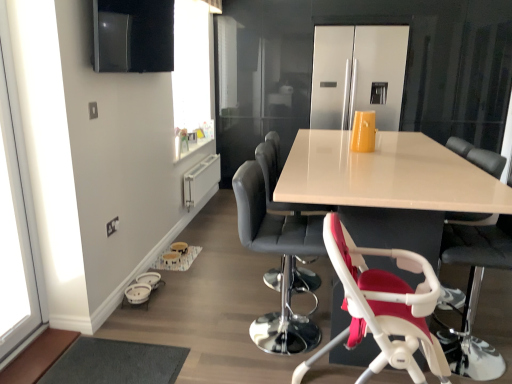
The height and width of the screenshot is (384, 512). I want to click on black leather bar stool at center, marked as the 2th chair in a back-to-front arrangement, so point(281,264).

Where is `white plastic highchair at lower right, which ranks as the second chair in front-to-back order`? The image size is (512, 384). white plastic highchair at lower right, which ranks as the second chair in front-to-back order is located at coordinates (474, 291).

The width and height of the screenshot is (512, 384). Describe the element at coordinates (474, 291) in the screenshot. I see `white plastic highchair at lower right, the 3th chair from the back` at that location.

What is the approximate width of leather-like black chair at center, which is counted as the 4th chair, starting from the front?

The width of leather-like black chair at center, which is counted as the 4th chair, starting from the front, is 15.42 inches.

What do you see at coordinates (278, 177) in the screenshot?
I see `leather-like black chair at center, which is the 1th chair from back to front` at bounding box center [278, 177].

The width and height of the screenshot is (512, 384). Find the location of `white plastic highchair at lower right, which is the 1th chair in front-to-back order`. white plastic highchair at lower right, which is the 1th chair in front-to-back order is located at coordinates (383, 307).

What do you see at coordinates (142, 289) in the screenshot? The image size is (512, 384). I see `white plastic baby carriage at lower left` at bounding box center [142, 289].

This screenshot has height=384, width=512. In order to click on black leather bar stool at center, marked as the 2th chair in a back-to-front arrangement in this screenshot , I will do `click(281, 264)`.

Is leather-like black chair at center, which is the 1th chair from back to front, far away from stainless steel refrigerator at center?

Yes.

Is leather-like black chair at center, which is the 1th chair from back to front, facing towards stainless steel refrigerator at center?

No, leather-like black chair at center, which is the 1th chair from back to front, is not aimed at stainless steel refrigerator at center.

From a real-world perspective, is leather-like black chair at center, which is counted as the 4th chair, starting from the front, beneath stainless steel refrigerator at center?

Yes, from a real-world perspective, leather-like black chair at center, which is counted as the 4th chair, starting from the front, is under stainless steel refrigerator at center.

Between point (266, 145) and point (316, 80), which one is positioned behind?

The point (316, 80) is farther from the camera.

Considering the sizes of objects stainless steel refrigerator at center and white plastic highchair at lower right, which appears as the 4th chair when viewed from the back, in the image provided, who is thinner, stainless steel refrigerator at center or white plastic highchair at lower right, which appears as the 4th chair when viewed from the back,?

Thinner between the two is stainless steel refrigerator at center.

Between point (313, 109) and point (346, 284), which one is positioned in front?

Point (346, 284)

Measure the distance between stainless steel refrigerator at center and white plastic highchair at lower right, which is the 1th chair in front-to-back order.

stainless steel refrigerator at center is 10.21 feet from white plastic highchair at lower right, which is the 1th chair in front-to-back order.

From a real-world perspective, between stainless steel refrigerator at center and white plastic highchair at lower right, which appears as the 4th chair when viewed from the back, who is vertically lower?

white plastic highchair at lower right, which appears as the 4th chair when viewed from the back.

Is transparent glass window at left taller than black leather bar stool at center, which is the 3th chair from front to back?

Correct, transparent glass window at left is much taller as black leather bar stool at center, which is the 3th chair from front to back.

From the picture: Is transparent glass window at left oriented away from black leather bar stool at center, marked as the 2th chair in a back-to-front arrangement?

No.

This screenshot has width=512, height=384. Identify the location of the 2nd chair behind the transparent glass window at left. (281, 264).

Is stainless steel refrigerator at center positioned before leather-like black chair at center, which is the 1th chair from back to front?

No, stainless steel refrigerator at center is behind leather-like black chair at center, which is the 1th chair from back to front.

Can you see stainless steel refrigerator at center touching leather-like black chair at center, which is counted as the 4th chair, starting from the front?

No, stainless steel refrigerator at center is not next to leather-like black chair at center, which is counted as the 4th chair, starting from the front.

Which is closer, (383, 31) or (298, 207)?

The point (298, 207) is closer to the camera.

Between stainless steel refrigerator at center and leather-like black chair at center, which is the 1th chair from back to front, which one appears on the right side from the viewer's perspective?

From the viewer's perspective, stainless steel refrigerator at center appears more on the right side.

Can you confirm if leather-like black chair at center, which is the 1th chair from back to front, is thinner than black leather bar stool at center, marked as the 2th chair in a back-to-front arrangement?

Yes.

From the image's perspective, is leather-like black chair at center, which is counted as the 4th chair, starting from the front, positioned above or below black leather bar stool at center, marked as the 2th chair in a back-to-front arrangement?

Based on their image positions, leather-like black chair at center, which is counted as the 4th chair, starting from the front, is located above black leather bar stool at center, marked as the 2th chair in a back-to-front arrangement.

Considering the positions of objects leather-like black chair at center, which is the 1th chair from back to front, and black leather bar stool at center, which is the 3th chair from front to back, in the image provided, who is in front, leather-like black chair at center, which is the 1th chair from back to front, or black leather bar stool at center, which is the 3th chair from front to back,?

Positioned in front is black leather bar stool at center, which is the 3th chair from front to back.

From a real-world perspective, does leather-like black chair at center, which is the 1th chair from back to front, sit lower than black leather bar stool at center, which is the 3th chair from front to back?

No, from a real-world perspective, leather-like black chair at center, which is the 1th chair from back to front, is not beneath black leather bar stool at center, which is the 3th chair from front to back.

Is white plastic highchair at lower right, which appears as the 4th chair when viewed from the back, oriented towards leather-like black chair at center, which is counted as the 4th chair, starting from the front?

No.

There is a white plastic highchair at lower right, which is the 1th chair in front-to-back order. At what (x,y) coordinates should I click in order to perform the action: click on the 2nd chair above it (from a real-world perspective). Please return your answer as a coordinate pair (x, y). The width and height of the screenshot is (512, 384). Looking at the image, I should click on (278, 177).

Between white plastic highchair at lower right, which appears as the 4th chair when viewed from the back, and leather-like black chair at center, which is the 1th chair from back to front, which one has less height?

white plastic highchair at lower right, which appears as the 4th chair when viewed from the back.

Based on the photo, which of these two, white plastic highchair at lower right, which appears as the 4th chair when viewed from the back, or leather-like black chair at center, which is the 1th chair from back to front, is wider?

With larger width is white plastic highchair at lower right, which appears as the 4th chair when viewed from the back.

Where is `table behind the transparent glass window at left`? Image resolution: width=512 pixels, height=384 pixels. table behind the transparent glass window at left is located at coordinates click(x=389, y=187).

From the image's perspective, which one is positioned lower, white glossy table at center or transparent glass window at left?

white glossy table at center appears lower in the image.

Between white glossy table at center and transparent glass window at left, which one appears on the left side from the viewer's perspective?

Positioned to the left is transparent glass window at left.

Is point (382, 197) closer to camera compared to point (46, 302)?

Yes, it is in front of point (46, 302).

From a real-world perspective, starting from the stainless steel refrigerator at center, which chair is the 2nd one below it? Please provide its 2D coordinates.

[(278, 177)]

Find the location of `appliance above the white plastic highchair at lower right, which is the 1th chair in front-to-back order (from the image's perspective)`. appliance above the white plastic highchair at lower right, which is the 1th chair in front-to-back order (from the image's perspective) is located at coordinates [358, 74].

Based on the photo, when comparing their distances from white plastic highchair at lower right, which ranks as the second chair in front-to-back order, does leather-like black chair at center, which is the 1th chair from back to front, or white glossy table at center seem closer?

white glossy table at center.

From the image, which object appears to be farther from white glossy table at center, transparent glass window at left or leather-like black chair at center, which is counted as the 4th chair, starting from the front?

transparent glass window at left is further to white glossy table at center.

Looking at the image, which one is located further to leather-like black chair at center, which is the 1th chair from back to front, stainless steel refrigerator at center or transparent glass window at left?

Answer: Among the two, stainless steel refrigerator at center is located further to leather-like black chair at center, which is the 1th chair from back to front.

Estimate the real-world distances between objects in this image. Which object is further from black leather bar stool at center, marked as the 2th chair in a back-to-front arrangement, white plastic highchair at lower right, which appears as the 4th chair when viewed from the back, or white plastic highchair at lower right, the 3th chair from the back?

white plastic highchair at lower right, the 3th chair from the back.

Estimate the real-world distances between objects in this image. Which object is closer to white plastic highchair at lower right, which is the 1th chair in front-to-back order, transparent glass window at left or white plastic highchair at lower right, which ranks as the second chair in front-to-back order?

white plastic highchair at lower right, which ranks as the second chair in front-to-back order, is closer to white plastic highchair at lower right, which is the 1th chair in front-to-back order.

When comparing their distances from white plastic baby carriage at lower left, does leather-like black chair at center, which is the 1th chair from back to front, or white plastic highchair at lower right, which is the 1th chair in front-to-back order, seem closer?

leather-like black chair at center, which is the 1th chair from back to front, lies closer to white plastic baby carriage at lower left than the other object.

Which object lies nearer to the anchor point black leather bar stool at center, marked as the 2th chair in a back-to-front arrangement, transparent glass window at left or stainless steel refrigerator at center?

Based on the image, transparent glass window at left appears to be nearer to black leather bar stool at center, marked as the 2th chair in a back-to-front arrangement.

From the image, which object appears to be farther from black leather bar stool at center, which is the 3th chair from front to back, white plastic highchair at lower right, which appears as the 4th chair when viewed from the back, or white glossy table at center?

The object further to black leather bar stool at center, which is the 3th chair from front to back, is white plastic highchair at lower right, which appears as the 4th chair when viewed from the back.

This screenshot has height=384, width=512. Identify the location of baby carriage between transparent glass window at left and white glossy table at center in the horizontal direction. (142, 289).

Identify the location of baby carriage between transparent glass window at left and leather-like black chair at center, which is the 1th chair from back to front, from left to right. This screenshot has width=512, height=384. (142, 289).

Find the location of a particular element. This screenshot has height=384, width=512. baby carriage between black leather bar stool at center, which is the 3th chair from front to back, and stainless steel refrigerator at center in the front-back direction is located at coordinates (142, 289).

Identify the location of table situated between white plastic baby carriage at lower left and white plastic highchair at lower right, the 3th chair from the back, from left to right. (389, 187).